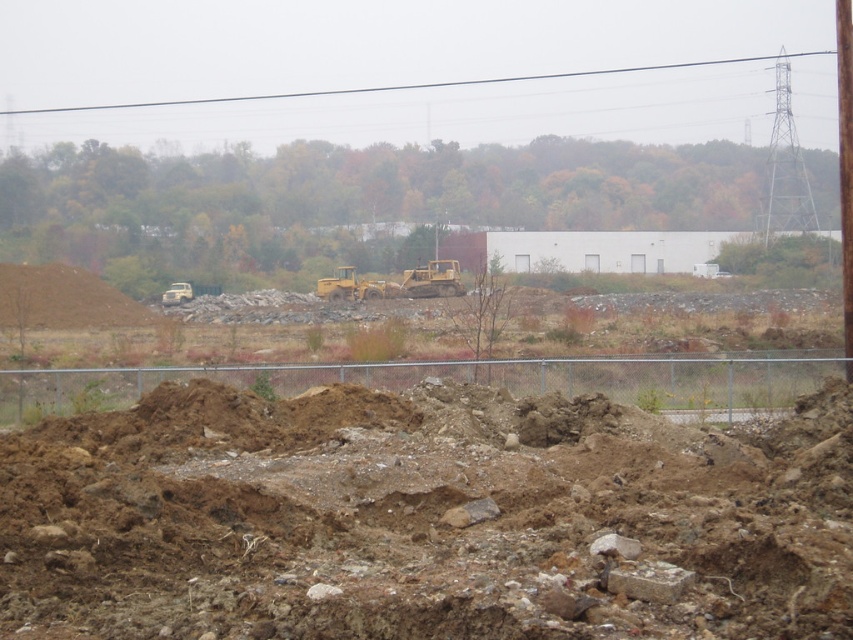
In the scene shown: Does black wire at upper center have a greater width compared to yellow metallic excavator at center?

Yes, black wire at upper center is wider than yellow metallic excavator at center.

What do you see at coordinates (410, 84) in the screenshot? I see `black wire at upper center` at bounding box center [410, 84].

Locate an element on the screen. black wire at upper center is located at coordinates (410, 84).